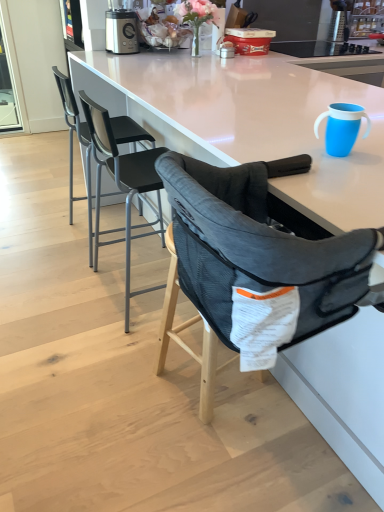
Question: Is transparent glass screen door at upper left wider or thinner than metallic silver blender at upper center?

Choices:
 (A) wide
 (B) thin

Answer: (B)

Question: From their relative heights in the image, would you say transparent glass screen door at upper left is taller or shorter than metallic silver blender at upper center?

Choices:
 (A) tall
 (B) short

Answer: (A)

Question: Which object is positioned closest to the mesh fabric high chair at center?

Choices:
 (A) matte plastic container at upper center
 (B) metallic silver blender at upper center
 (C) transparent glass screen door at upper left
 (D) dark gray mesh highchair at center, the 1th chair viewed from the front
 (E) black mesh chair at center, which is counted as the second chair, starting from the front

Answer: (D)

Question: Estimate the real-world distances between objects in this image. Which object is farther from the blue plastic cup at upper right?

Choices:
 (A) metallic silver blender at upper center
 (B) black mesh chair at upper left, placed as the 3th chair when sorted from front to back
 (C) mesh fabric high chair at center
 (D) dark gray mesh highchair at center, positioned as the third chair in back-to-front order
 (E) matte plastic container at upper center

Answer: (A)